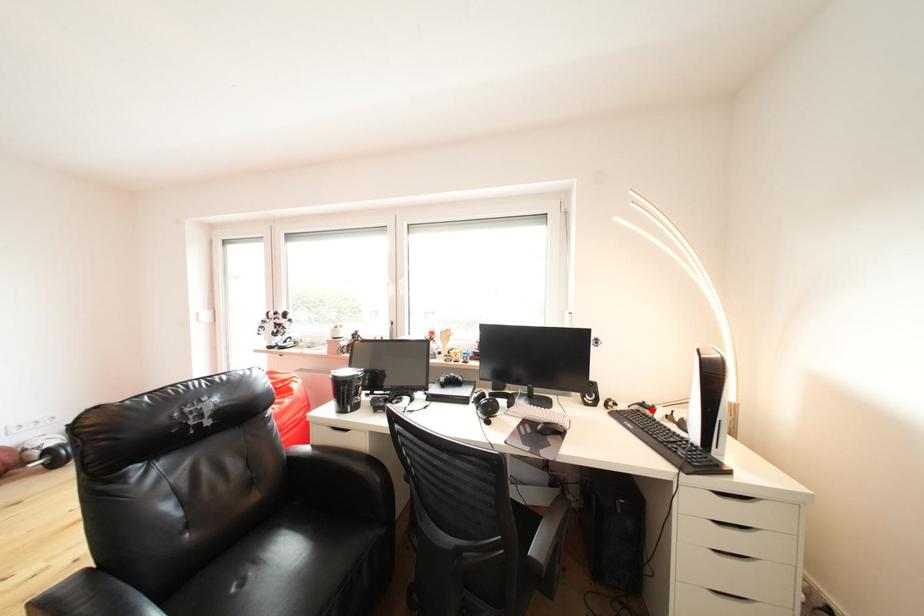
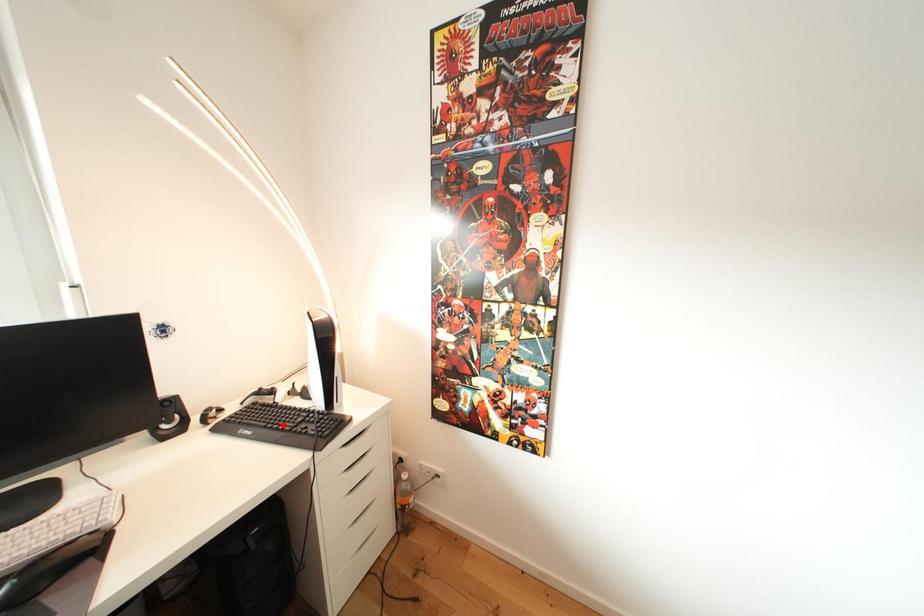
I am providing you with two images of the same scene from different viewpoints. A red point is marked on the first image and another point is marked on the second image. Do the highlighted points in image1 and image2 indicate the same real-world spot?

No